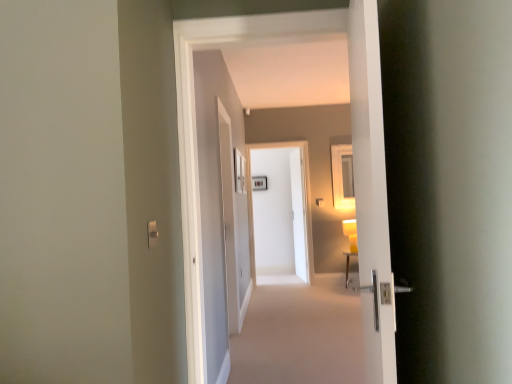
Question: Is there a large distance between satin silver switch at lower left and white glossy door at center, which appears as the second door when viewed from the front?

Choices:
 (A) yes
 (B) no

Answer: (A)

Question: Does satin silver switch at lower left lie in front of white glossy door at center, which appears as the second door when viewed from the front?

Choices:
 (A) yes
 (B) no

Answer: (A)

Question: Can you confirm if satin silver switch at lower left is shorter than white glossy door at center, which appears as the second door when viewed from the front?

Choices:
 (A) no
 (B) yes

Answer: (B)

Question: From a real-world perspective, is satin silver switch at lower left beneath white glossy door at center, which appears as the second door when viewed from the front?

Choices:
 (A) yes
 (B) no

Answer: (B)

Question: Can you confirm if satin silver switch at lower left is positioned to the left of white glossy door at center, the first door viewed from the back?

Choices:
 (A) yes
 (B) no

Answer: (A)

Question: From the image's perspective, is white glossy door handle at right positioned above or below white glossy door at center, which is the 2th door from back to front?

Choices:
 (A) above
 (B) below

Answer: (B)

Question: Is white glossy door handle at right taller or shorter than white glossy door at center, which is counted as the first door, starting from the front?

Choices:
 (A) short
 (B) tall

Answer: (A)

Question: Do you think white glossy door handle at right is within white glossy door at center, which is counted as the first door, starting from the front, or outside of it?

Choices:
 (A) outside
 (B) inside

Answer: (A)

Question: In the image, is white glossy door handle at right positioned in front of or behind white glossy door at center, which is the 2th door from back to front?

Choices:
 (A) behind
 (B) front

Answer: (A)

Question: From a real-world perspective, is white glossy door at center, which appears as the second door when viewed from the front, physically located above or below white glossy screen door at center?

Choices:
 (A) below
 (B) above

Answer: (A)

Question: Is white glossy door at center, which appears as the second door when viewed from the front, taller or shorter than white glossy screen door at center?

Choices:
 (A) tall
 (B) short

Answer: (B)

Question: In the image, is white glossy door at center, which appears as the second door when viewed from the front, on the left side or the right side of white glossy screen door at center?

Choices:
 (A) left
 (B) right

Answer: (A)

Question: Is white glossy door at center, which appears as the second door when viewed from the front, wider or thinner than white glossy screen door at center?

Choices:
 (A) wide
 (B) thin

Answer: (B)

Question: From a real-world perspective, is white glossy door at center, which is the 2th door from back to front, above or below satin silver switch at lower left?

Choices:
 (A) above
 (B) below

Answer: (A)

Question: Does point (384, 200) appear closer or farther from the camera than point (155, 228)?

Choices:
 (A) closer
 (B) farther

Answer: (A)